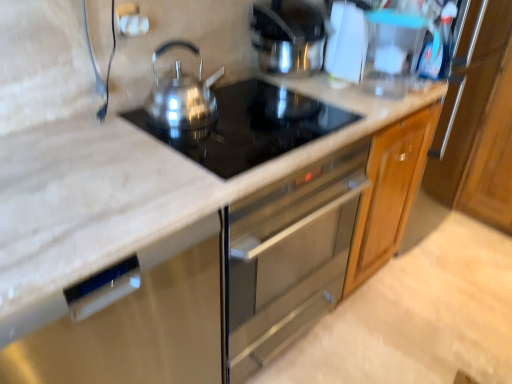
Where is `vacant region under satin black cooktop at center (from a real-world perspective)`? vacant region under satin black cooktop at center (from a real-world perspective) is located at coordinates (274, 130).